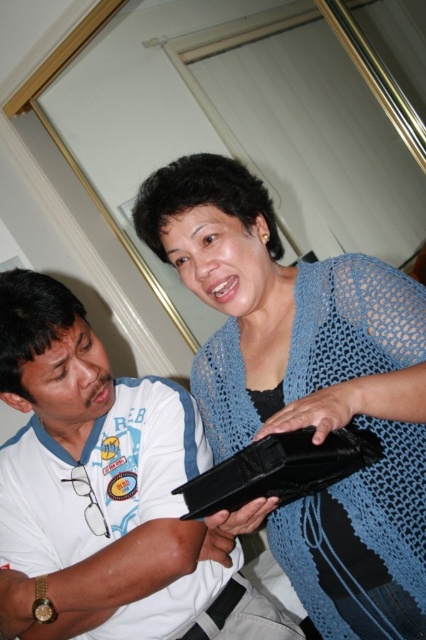
Can you confirm if blue knitted sweater at center is wider than white matte shirt at lower left?

In fact, blue knitted sweater at center might be narrower than white matte shirt at lower left.

Where is `blue knitted sweater at center`? This screenshot has width=426, height=640. blue knitted sweater at center is located at coordinates tap(307, 387).